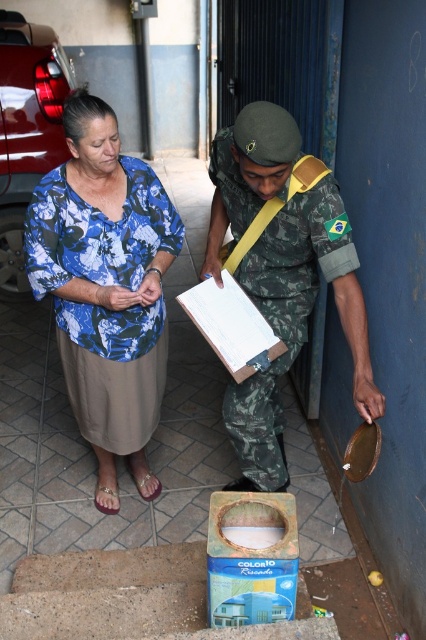
Is blue floral blouse at center positioned before camouflage uniform at center?

No.

Which is in front, point (157, 188) or point (307, 211)?

Positioned in front is point (307, 211).

Is point (175, 230) farther from viewer compared to point (241, 236)?

Yes, it is.

Where is `blue floral blouse at center`? The image size is (426, 640). blue floral blouse at center is located at coordinates (106, 288).

Who is more forward, [158,380] or [244,362]?

Positioned in front is point [244,362].

Can you confirm if blue floral blouse at center is positioned below white cardboard clipboard at center?

Actually, blue floral blouse at center is above white cardboard clipboard at center.

You are a GUI agent. You are given a task and a screenshot of the screen. Output one action in this format:
    pyautogui.click(x=<x>, y=<y>)
    Task: Click on the blue floral blouse at center
    Image resolution: width=426 pixels, height=640 pixels.
    Given the screenshot: What is the action you would take?
    pyautogui.click(x=106, y=288)

Does camouflage uniform at center have a greater height compared to white cardboard clipboard at center?

Yes, camouflage uniform at center is taller than white cardboard clipboard at center.

Is the position of camouflage uniform at center more distant than that of white cardboard clipboard at center?

No, camouflage uniform at center is closer to the viewer.

Is point (267, 189) farther from camera compared to point (236, 356)?

No, it is not.

Image resolution: width=426 pixels, height=640 pixels. Identify the location of camouflage uniform at center. (281, 276).